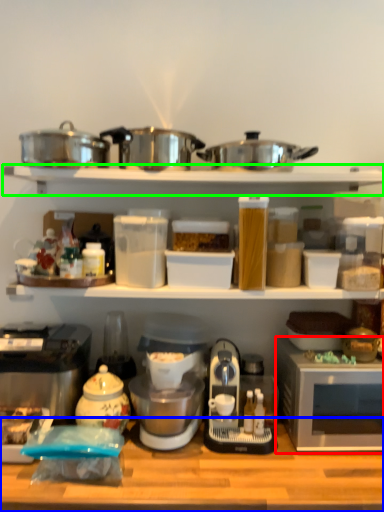
Question: Estimate the real-world distances between objects in this image. Which object is closer to microwave oven (highlighted by a red box), table (highlighted by a blue box) or shelf (highlighted by a green box)?

Choices:
 (A) table
 (B) shelf

Answer: (A)